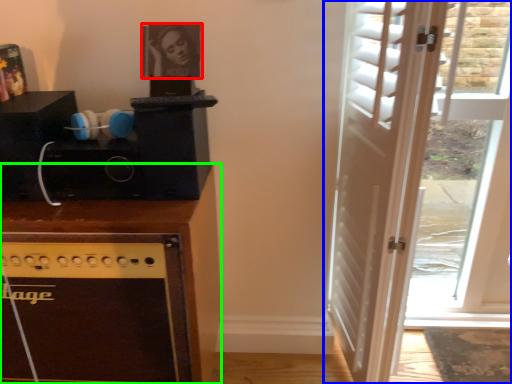
Question: Based on their relative distances, which object is farther from picture frame (highlighted by a red box)? Choose from door (highlighted by a blue box) and cabinetry (highlighted by a green box).

Choices:
 (A) door
 (B) cabinetry

Answer: (A)